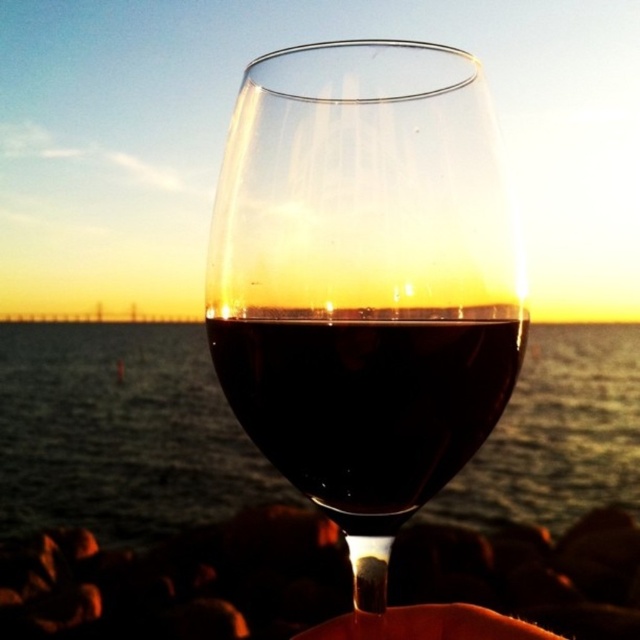
Is point (392, 308) positioned before point (428, 397)?

Yes, it is.

Which is behind, point (385, 220) or point (468, 452)?

The point (468, 452) is behind.

Locate an element on the screen. Image resolution: width=640 pixels, height=640 pixels. transparent glass at center is located at coordinates (364, 280).

Does transparent liquid at center appear over shiny dark red wine at center?

No, transparent liquid at center is not above shiny dark red wine at center.

Does transparent liquid at center lie behind shiny dark red wine at center?

Yes.

Is point (257, 456) positioned after point (384, 408)?

Yes.

Locate an element on the screen. The height and width of the screenshot is (640, 640). transparent liquid at center is located at coordinates (120, 433).

Does transparent liquid at center appear under matte skin hand at center?

Actually, transparent liquid at center is above matte skin hand at center.

Can you confirm if transparent liquid at center is shorter than matte skin hand at center?

No.

Does point (163, 376) come farther from viewer compared to point (305, 636)?

Yes, point (163, 376) is farther from viewer.

Where is `transparent liquid at center`? This screenshot has width=640, height=640. transparent liquid at center is located at coordinates click(x=120, y=433).